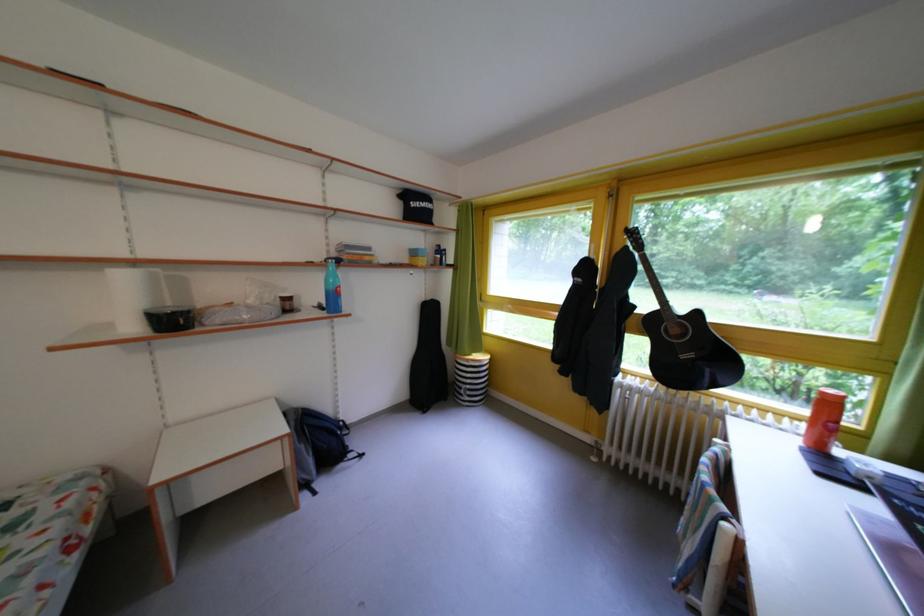
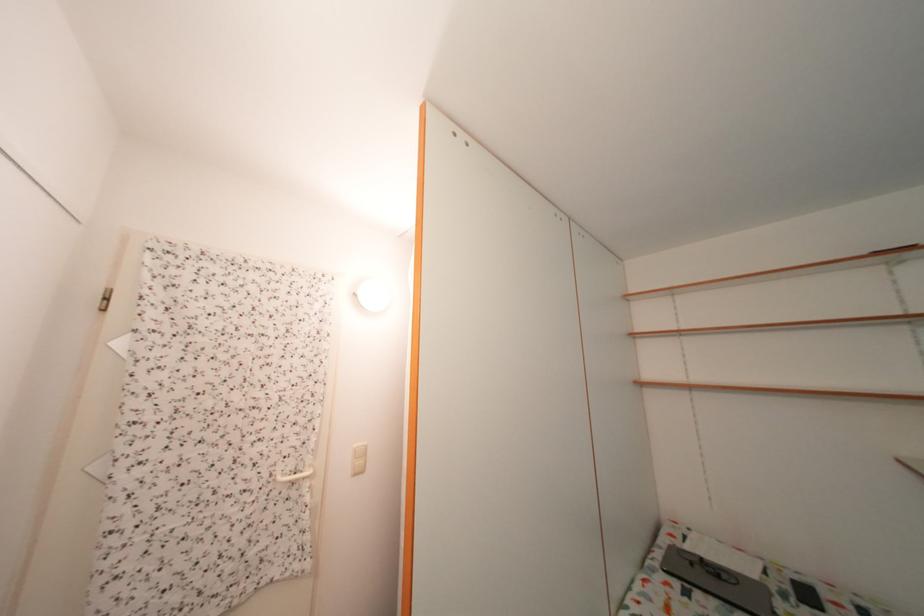
Question: The images are taken continuously from a first-person perspective. In which direction is your viewpoint rotating?

Choices:
 (A) Left
 (B) Right
 (C) Up
 (D) Down

Answer: (A)